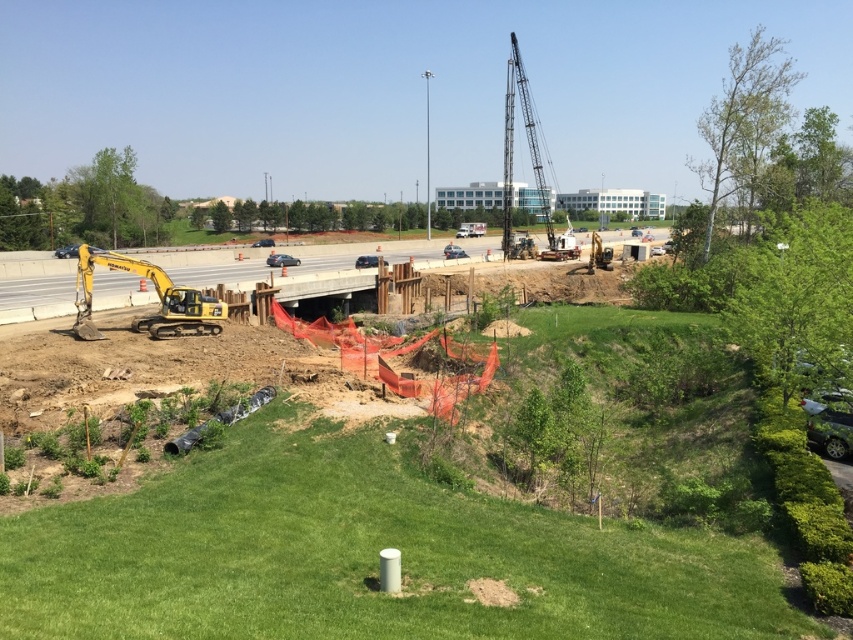
Looking at this image, is yellow excavator at lower left closer to camera compared to yellow metallic excavator at lower left?

That is False.

You are a GUI agent. You are given a task and a screenshot of the screen. Output one action in this format:
    pyautogui.click(x=<x>, y=<y>)
    Task: Click on the yellow excavator at lower left
    
    Given the screenshot: What is the action you would take?
    pyautogui.click(x=323, y=280)

Identify the location of yellow excavator at lower left. The height and width of the screenshot is (640, 853). (323, 280).